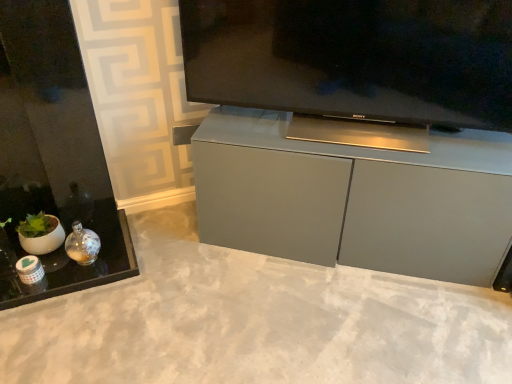
Identify the location of empty space that is ontop of matte gray concrete at center. This screenshot has height=384, width=512. (251, 307).